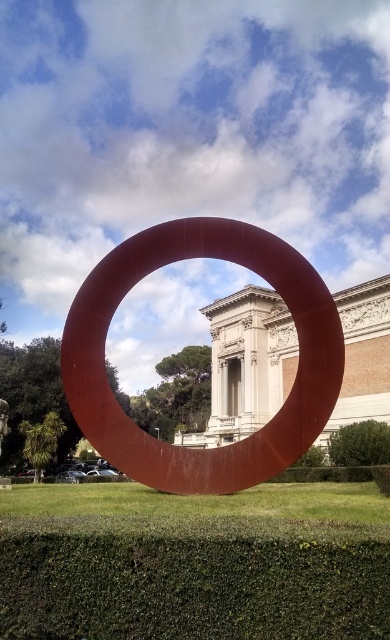
Question: Which object is closer to the camera taking this photo?

Choices:
 (A) matte red ring at center
 (B) green leafy hedge at lower right

Answer: (A)

Question: Which of the following is the farthest from the observer?

Choices:
 (A) (99, 442)
 (B) (338, 440)

Answer: (B)

Question: Is matte red ring at center above green leafy hedge at lower right?

Choices:
 (A) no
 (B) yes

Answer: (B)

Question: Is matte red ring at center thinner than green leafy hedge at lower right?

Choices:
 (A) yes
 (B) no

Answer: (B)

Question: Does matte red ring at center have a larger size compared to green leafy hedge at lower right?

Choices:
 (A) yes
 (B) no

Answer: (A)

Question: Which point is farther to the camera?

Choices:
 (A) (310, 372)
 (B) (352, 445)

Answer: (B)